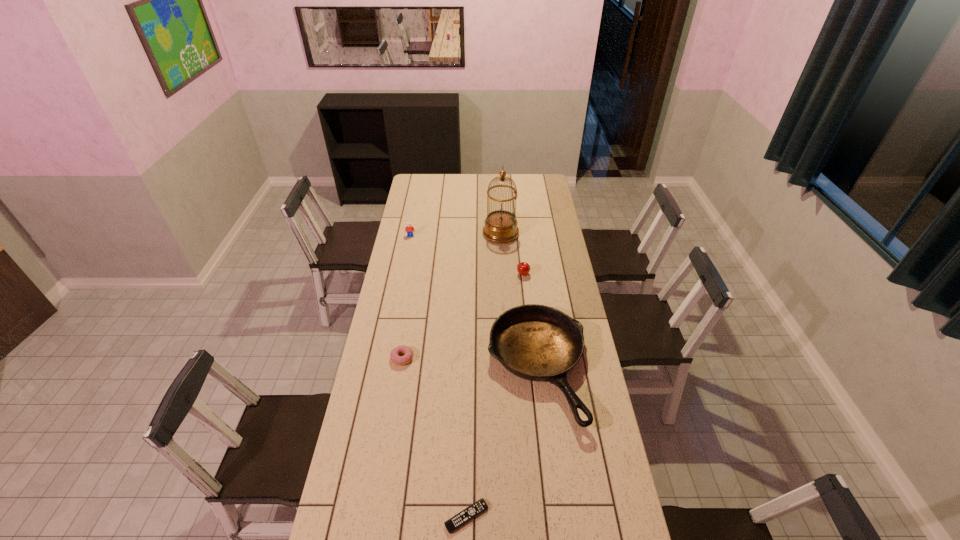
The image size is (960, 540). In order to click on birdcage in this screenshot , I will do `click(500, 226)`.

Identify the location of Lego. The image size is (960, 540). (409, 228).

Where is `the third farthest object`? The height and width of the screenshot is (540, 960). the third farthest object is located at coordinates (523, 268).

Where is `frying pan`? frying pan is located at coordinates (535, 342).

You are a GUI agent. You are given a task and a screenshot of the screen. Output one action in this format:
    pyautogui.click(x=<x>, y=<y>)
    Task: Click on the fifth tallest object
    This screenshot has height=540, width=960.
    Given the screenshot: What is the action you would take?
    pyautogui.click(x=394, y=355)

Image resolution: width=960 pixels, height=540 pixels. I want to click on the shortest object, so click(x=478, y=507).

Identify the location of the nearest object. (478, 507).

Locate an element on the screen. The height and width of the screenshot is (540, 960). vacant position located with an open door on the tallest object is located at coordinates (420, 233).

Find the location of `free space located with an open door on the tallest object`. free space located with an open door on the tallest object is located at coordinates click(422, 233).

You are a GUI agent. You are given a task and a screenshot of the screen. Output one action in this format:
    pyautogui.click(x=<x>, y=<y>)
    Task: Click on the free space located with an open door on the tallest object
    
    Given the screenshot: What is the action you would take?
    pyautogui.click(x=426, y=233)